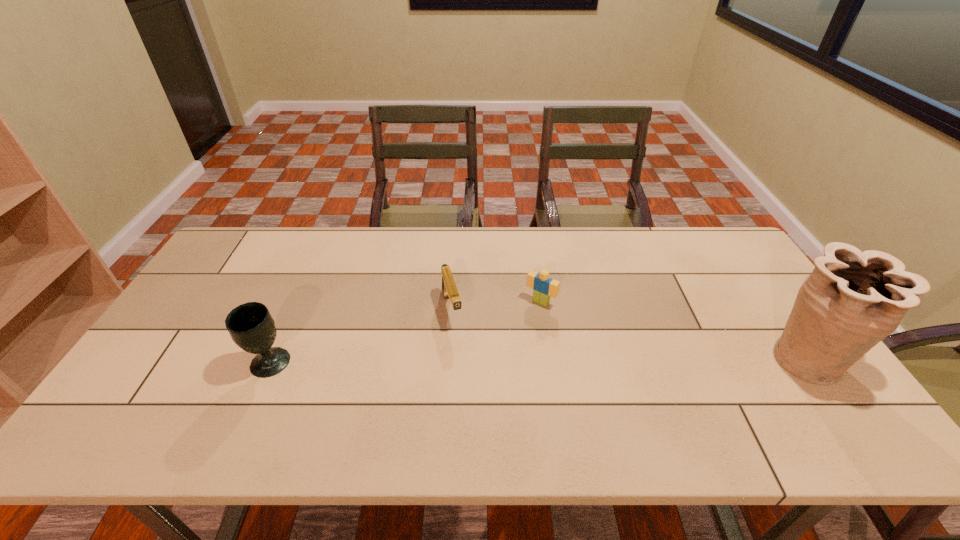
In the image, there is a desktop. Where is `vacant space at the right edge`? vacant space at the right edge is located at coordinates (741, 290).

The width and height of the screenshot is (960, 540). Find the location of `free space at the far left corner of the desktop`. free space at the far left corner of the desktop is located at coordinates (272, 238).

In order to click on vacant space at the far right corner of the desktop in this screenshot , I will do `click(738, 253)`.

I want to click on blank region between the Lego and the chalice, so click(x=405, y=333).

Locate an element on the screen. This screenshot has width=960, height=540. free point between the pistol and the Lego is located at coordinates (496, 306).

Locate an element on the screen. free area in between the urn and the Lego is located at coordinates (673, 330).

Where is `free spot between the second tallest object and the pistol`? Image resolution: width=960 pixels, height=540 pixels. free spot between the second tallest object and the pistol is located at coordinates (361, 336).

I want to click on empty space that is in between the third object from left to right and the urn, so click(673, 330).

The image size is (960, 540). What are the coordinates of `free space between the pistol and the tallest object` in the screenshot? It's located at (629, 334).

The height and width of the screenshot is (540, 960). What are the coordinates of `vacant space that is in between the third object from right to left and the tallest object` in the screenshot? It's located at (629, 334).